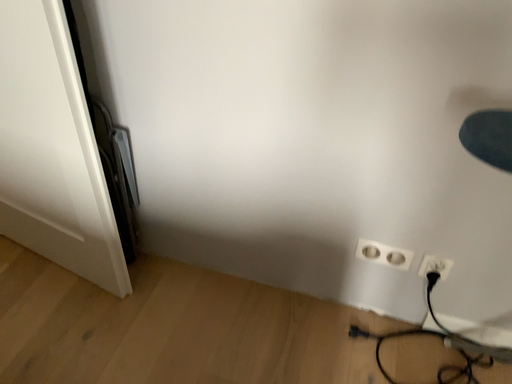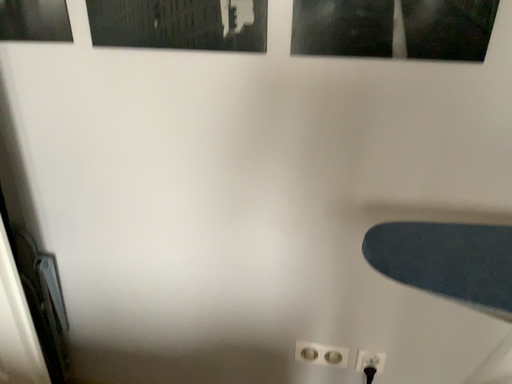
Question: Which way did the camera rotate in the video?

Choices:
 (A) rotated downward
 (B) rotated upward

Answer: (B)